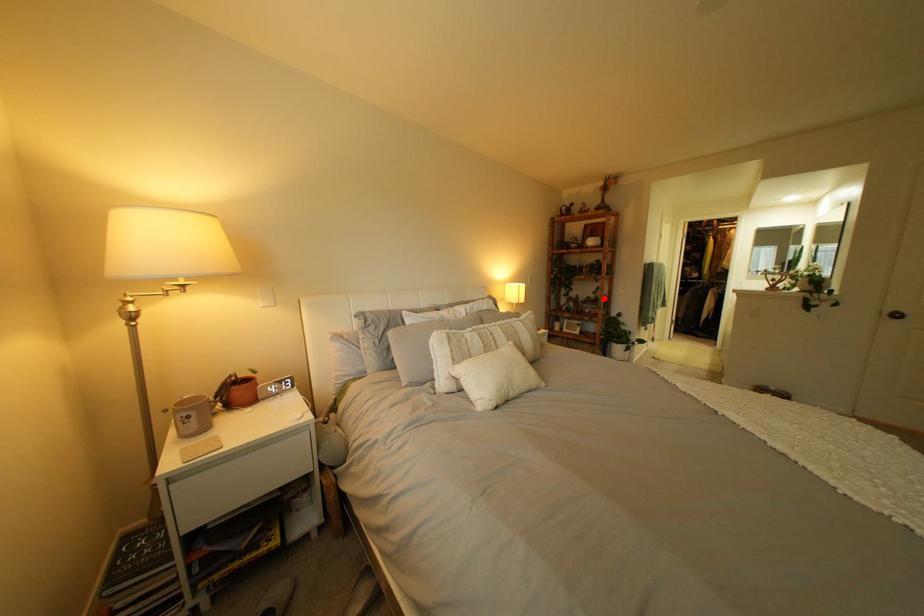
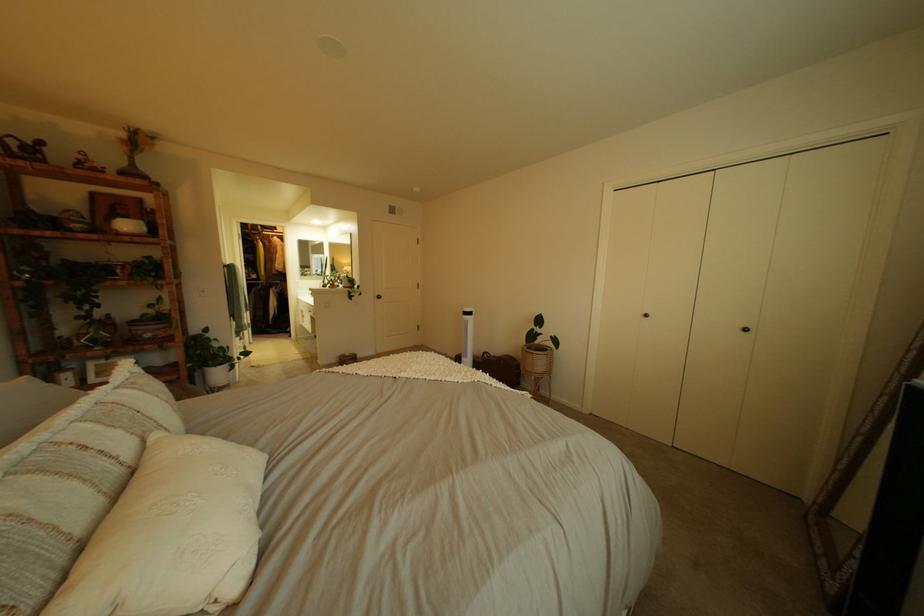
Find the pixel in the second image that matches the highlighted location in the first image.

(161, 315)